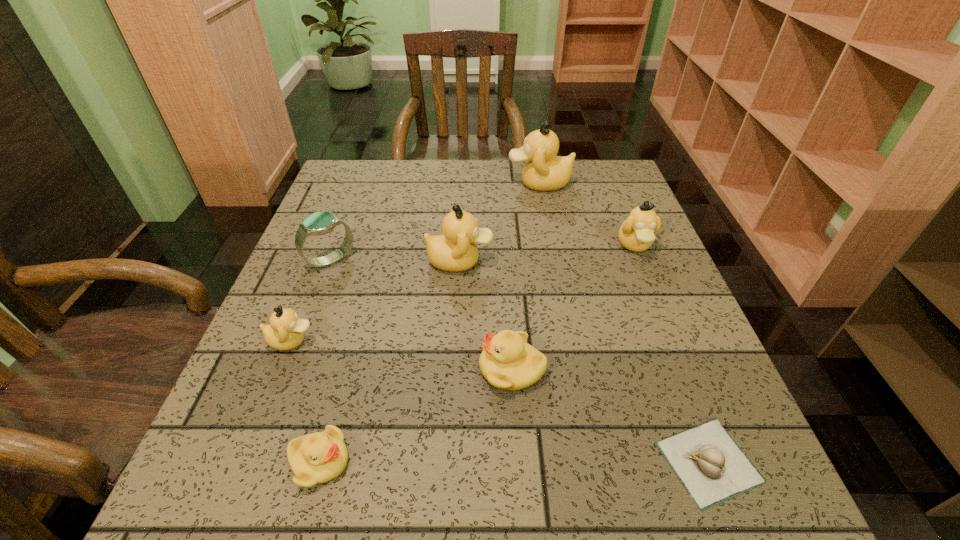
Locate an element on the screen. This screenshot has height=540, width=960. garlic present at the right edge is located at coordinates point(711,466).

Find the location of a particular element. object present at the near left corner is located at coordinates (319, 457).

At what (x,y) coordinates should I click in order to perform the action: click on object located in the far right corner section of the desktop. Please return your answer as a coordinate pair (x, y). The height and width of the screenshot is (540, 960). Looking at the image, I should click on (544, 171).

In order to click on object present at the near right corner in this screenshot , I will do `click(711, 466)`.

Where is `blank space at the far edge of the desktop`? blank space at the far edge of the desktop is located at coordinates (433, 164).

The width and height of the screenshot is (960, 540). Identify the location of free region at the near edge of the desktop. (433, 491).

The image size is (960, 540). Identify the location of free point at the left edge. (332, 347).

You are a GUI agent. You are given a task and a screenshot of the screen. Output one action in this format:
    pyautogui.click(x=<x>, y=<y>)
    Task: Click on the vacant space at the right edge of the desktop
    This screenshot has width=960, height=540.
    Given the screenshot: What is the action you would take?
    pyautogui.click(x=592, y=220)

Where is `free space at the far left corner of the desktop`? free space at the far left corner of the desktop is located at coordinates 347,196.

In the image, there is a desktop. Identify the location of vacant space at the far right corner. The image size is (960, 540). (594, 164).